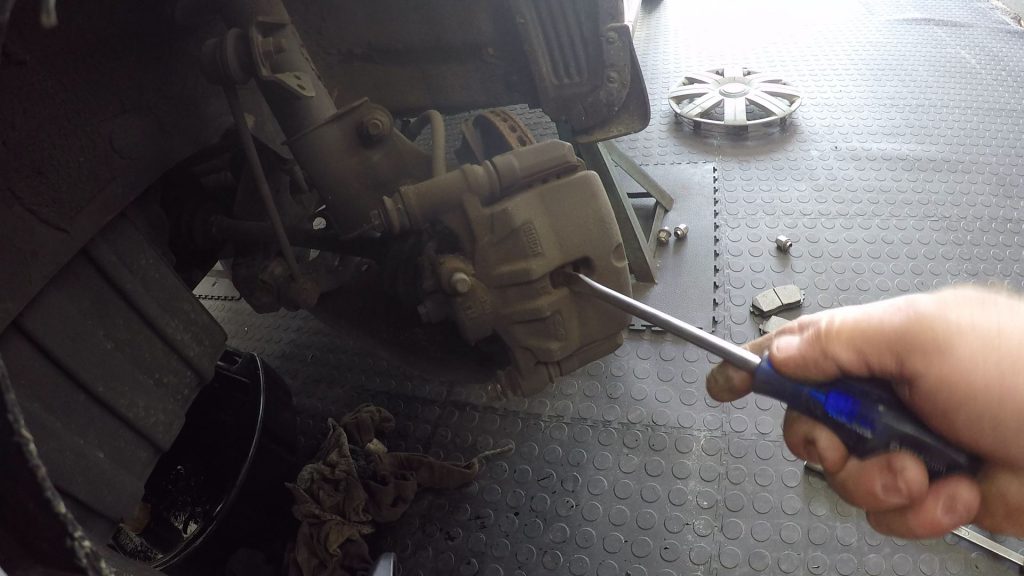
Find the location of a particular element. The width and height of the screenshot is (1024, 576). grey vinyl flooring is located at coordinates (853, 204).